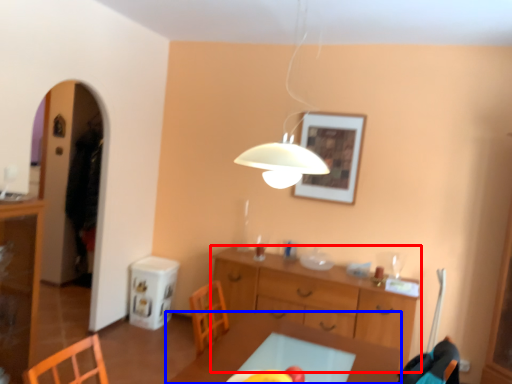
Question: Which point is further to the camera, desk (highlighted by a red box) or table (highlighted by a blue box)?

Choices:
 (A) desk
 (B) table

Answer: (A)